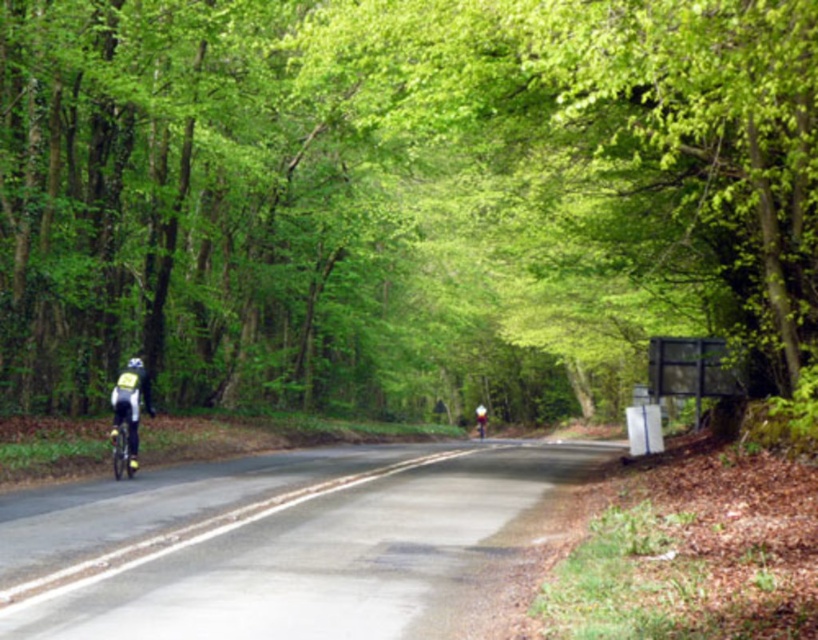
Question: From the image, what is the correct spatial relationship of reflective yellow vest at left in relation to white matte bicycle helmet at left?

Choices:
 (A) below
 (B) above

Answer: (A)

Question: Which is farther from the green leafy tree at center?

Choices:
 (A) matte black helmet at center
 (B) shiny metallic bicycle at left
 (C) reflective yellow vest at left
 (D) white matte bicycle helmet at left

Answer: (C)

Question: Which point appears farthest from the camera in this image?

Choices:
 (A) (133, 458)
 (B) (137, 406)
 (C) (479, 420)
 (D) (19, 244)

Answer: (C)

Question: Among these objects, which one is farthest from the camera?

Choices:
 (A) green leafy tree at center
 (B) matte black helmet at center

Answer: (B)

Question: Does green leafy tree at center appear under white matte bicycle helmet at left?

Choices:
 (A) yes
 (B) no

Answer: (B)

Question: Can you confirm if shiny metallic bicycle at left is positioned to the right of white matte bicycle helmet at left?

Choices:
 (A) yes
 (B) no

Answer: (A)